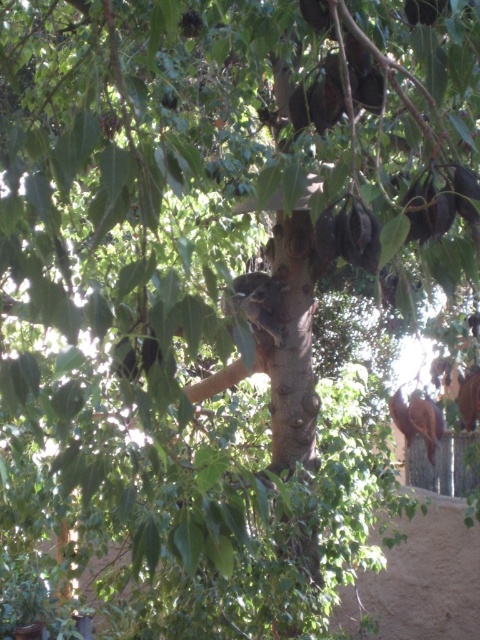
Between brown fuzzy fruit at upper center and green matte fruit at upper center, which one appears on the right side from the viewer's perspective?

brown fuzzy fruit at upper center

Consider the image. Can you confirm if brown fuzzy fruit at upper center is taller than green matte fruit at upper center?

No, brown fuzzy fruit at upper center is not taller than green matte fruit at upper center.

Between point (406, 12) and point (202, 20), which one is positioned in front?

Point (406, 12) is more forward.

Identify the location of brown fuzzy fruit at upper center. (424, 10).